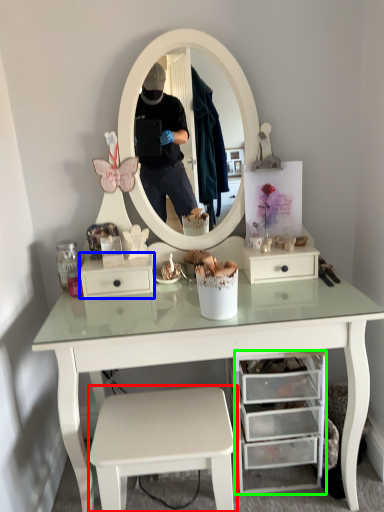
Question: Which object is the farthest from stool (highlighted by a red box)? Choose among these: drawer (highlighted by a blue box) or drawer (highlighted by a green box).

Choices:
 (A) drawer
 (B) drawer

Answer: (A)